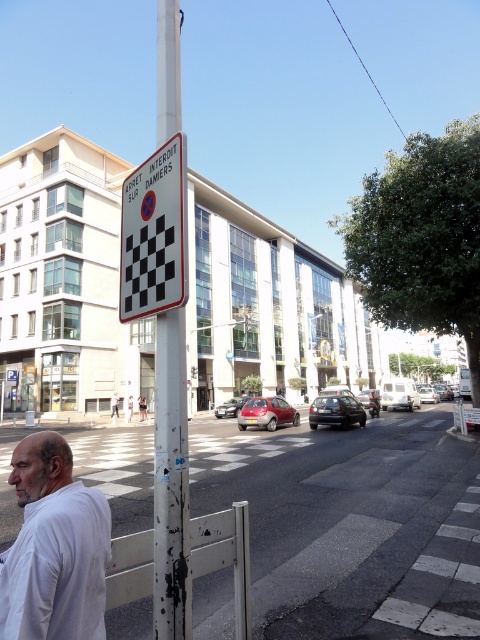
You are a pedestrian standing at the camera position. You want to cross the street to the other side. The white matte shirt at lower left is a person walking away from you. Can you safely cross the street before the person reaches you?

The distance between the white matte shirt at lower left and the camera is 5.15 feet. Since the person is walking away from you, they are moving away and will not reach you. Therefore, you can safely cross the street before the person reaches you.

You are a pedestrian standing at the location of the white matte shirt at lower left. You want to walk to the white painted metal pole at center. Given that your average walking speed is 1.5 meters per second, how many seconds will it take you to reach the pole?

The distance between the white matte shirt at lower left and the white painted metal pole at center is 12.63 meters. At a walking speed of 1.5 meters per second, it would take approximately 8.42 seconds to reach the pole.

You are a pedestrian standing on the sidewalk and see the white matte shirt at lower left and the white plastic sign at upper center. Which object takes up more space in the image?

The white plastic sign at upper center takes up more space in the image than the white matte shirt at lower left because the white matte shirt at lower left occupies less space than white plastic sign at upper center.